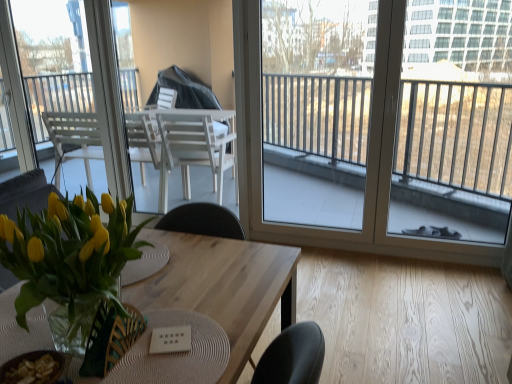
Question: Visually, is green woven armchair at center positioned to the left or to the right of translucent glass vase at lower left?

Choices:
 (A) left
 (B) right

Answer: (B)

Question: Does point (124, 329) appear closer or farther from the camera than point (86, 203)?

Choices:
 (A) farther
 (B) closer

Answer: (B)

Question: Estimate the real-world distances between objects in this image. Which object is farther from the transparent glass window at center, marked as the first window in a right-to-left arrangement?

Choices:
 (A) green woven armchair at center
 (B) wooden table at center
 (C) transparent glass window at upper left, which is the 1th window from left to right
 (D) translucent glass vase at lower left

Answer: (A)

Question: Based on their relative distances, which object is nearer to the green woven armchair at center?

Choices:
 (A) translucent glass vase at lower left
 (B) wooden table at center
 (C) transparent glass window at center, marked as the first window in a right-to-left arrangement
 (D) transparent glass window at upper left, marked as the 2th window in a right-to-left arrangement

Answer: (A)